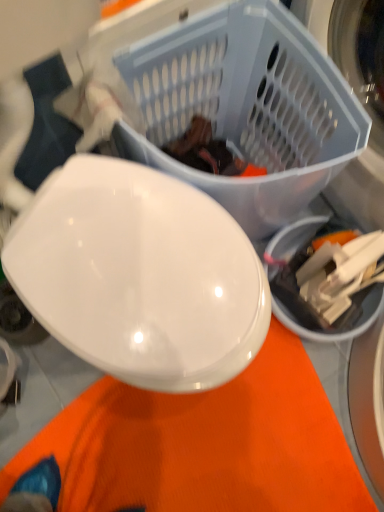
Question: Is dark brown fabric at center oriented towards matte plastic laundry basket at upper center?

Choices:
 (A) no
 (B) yes

Answer: (B)

Question: Considering the relative sizes of dark brown fabric at center and matte plastic laundry basket at upper center in the image provided, is dark brown fabric at center wider than matte plastic laundry basket at upper center?

Choices:
 (A) no
 (B) yes

Answer: (A)

Question: Is dark brown fabric at center further to camera compared to matte plastic laundry basket at upper center?

Choices:
 (A) yes
 (B) no

Answer: (A)

Question: Can you confirm if dark brown fabric at center is positioned to the right of matte plastic laundry basket at upper center?

Choices:
 (A) yes
 (B) no

Answer: (B)

Question: From a real-world perspective, is dark brown fabric at center located higher than matte plastic laundry basket at upper center?

Choices:
 (A) yes
 (B) no

Answer: (B)

Question: Is dark brown fabric at center taller than matte plastic laundry basket at upper center?

Choices:
 (A) yes
 (B) no

Answer: (B)

Question: Considering the relative sizes of matte plastic laundry basket at upper center and dark brown fabric at center in the image provided, is matte plastic laundry basket at upper center thinner than dark brown fabric at center?

Choices:
 (A) yes
 (B) no

Answer: (B)

Question: Does matte plastic laundry basket at upper center come behind dark brown fabric at center?

Choices:
 (A) no
 (B) yes

Answer: (A)

Question: Is matte plastic laundry basket at upper center facing towards dark brown fabric at center?

Choices:
 (A) no
 (B) yes

Answer: (B)

Question: From the image's perspective, would you say matte plastic laundry basket at upper center is positioned over dark brown fabric at center?

Choices:
 (A) no
 (B) yes

Answer: (A)

Question: Is matte plastic laundry basket at upper center at the right side of dark brown fabric at center?

Choices:
 (A) no
 (B) yes

Answer: (B)

Question: Does matte plastic laundry basket at upper center appear on the left side of dark brown fabric at center?

Choices:
 (A) no
 (B) yes

Answer: (A)

Question: In terms of width, does dark brown fabric at center look wider or thinner when compared to matte plastic laundry basket at upper center?

Choices:
 (A) wide
 (B) thin

Answer: (B)